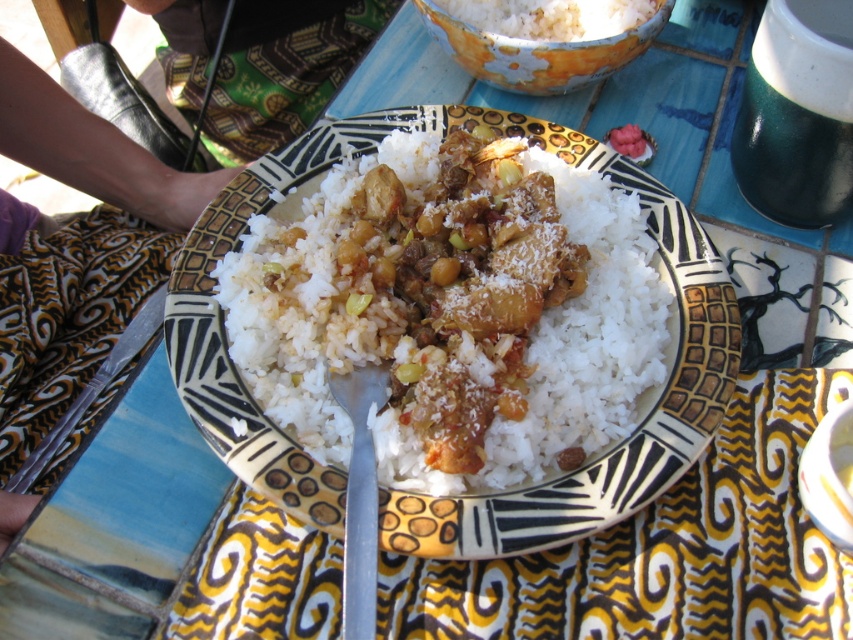
Is speckled ceramic bowl at upper center smaller than silver metallic fork at center?

Actually, speckled ceramic bowl at upper center might be larger than silver metallic fork at center.

Between speckled ceramic bowl at upper center and silver metallic fork at center, which one has less height?

With less height is speckled ceramic bowl at upper center.

Find the location of a particular element. The width and height of the screenshot is (853, 640). speckled ceramic bowl at upper center is located at coordinates (538, 52).

Does white polished rice at center appear on the left side of speckled ceramic bowl at upper center?

Yes, white polished rice at center is to the left of speckled ceramic bowl at upper center.

Is white polished rice at center shorter than speckled ceramic bowl at upper center?

No, white polished rice at center is not shorter than speckled ceramic bowl at upper center.

Does point (631, 401) come in front of point (474, 72)?

Yes, it is.

Locate an element on the screen. white polished rice at center is located at coordinates (451, 312).

Which of these two, white polished rice at center or silver metallic fork at center, stands taller?

Standing taller between the two is white polished rice at center.

From the picture: Can you confirm if white polished rice at center is thinner than silver metallic fork at center?

No.

Where is `white polished rice at center`? white polished rice at center is located at coordinates (451, 312).

Identify the location of white polished rice at center. This screenshot has height=640, width=853. (451, 312).